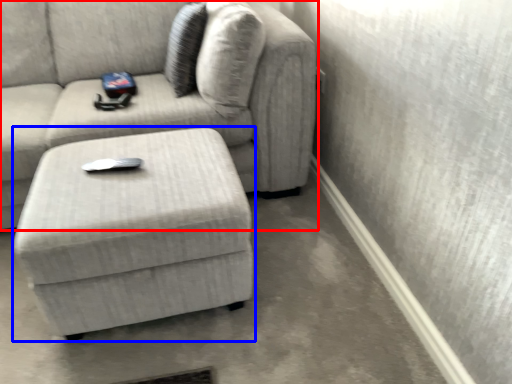
Question: Among these objects, which one is farthest to the camera, studio couch (highlighted by a red box) or table (highlighted by a blue box)?

Choices:
 (A) studio couch
 (B) table

Answer: (A)